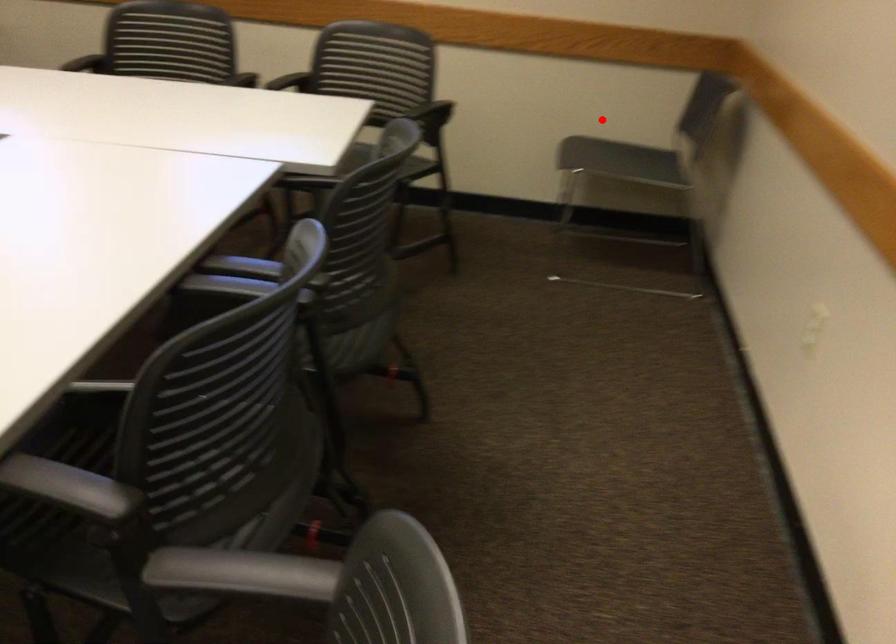
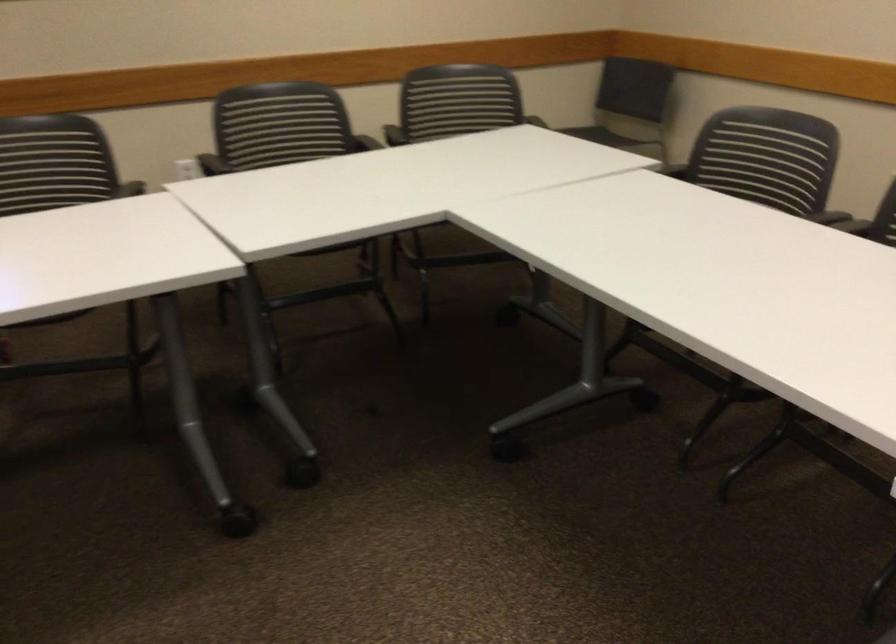
Where in the second image is the point corresponding to the highlighted location from the first image?

(529, 113)